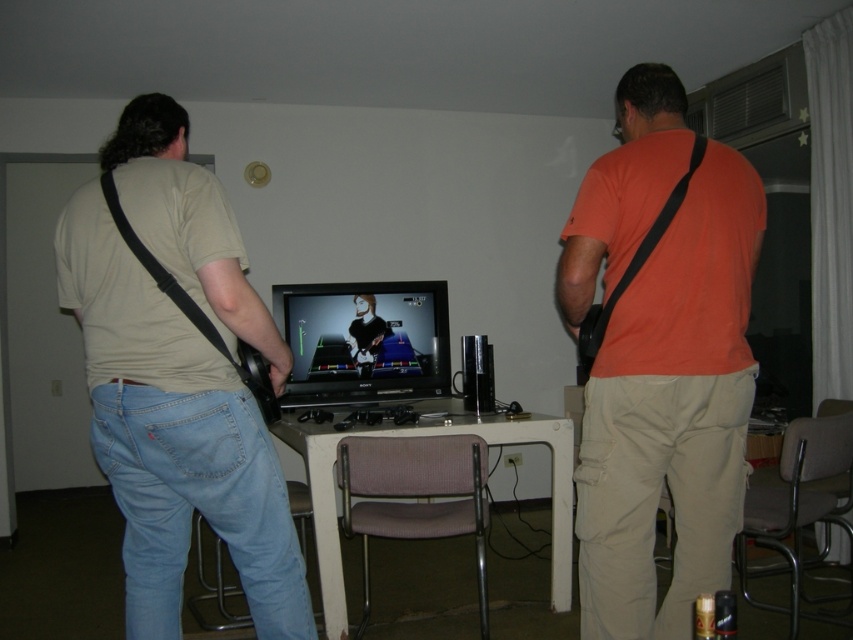
Is orange matte shirt at center to the left of white plastic table at center from the viewer's perspective?

No, orange matte shirt at center is not to the left of white plastic table at center.

Describe the element at coordinates (671, 412) in the screenshot. I see `orange matte shirt at center` at that location.

Where is `orange matte shirt at center`? orange matte shirt at center is located at coordinates (671, 412).

Who is more forward, (192,262) or (469,426)?

Point (192,262) is more forward.

Describe the element at coordinates (173, 436) in the screenshot. I see `matte beige shirt at left` at that location.

Identify the location of matte beige shirt at left. (173, 436).

Can you confirm if orange matte shirt at center is smaller than matte beige shirt at left?

Indeed, orange matte shirt at center has a smaller size compared to matte beige shirt at left.

Between point (611, 248) and point (109, 225), which one is positioned behind?

Point (611, 248)

Is point (582, 248) in front of point (105, 376)?

That is False.

Identify the location of orange matte shirt at center. (671, 412).